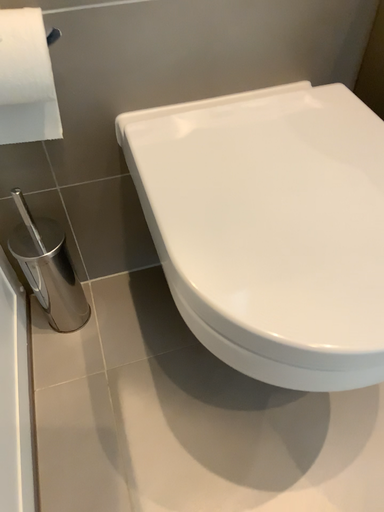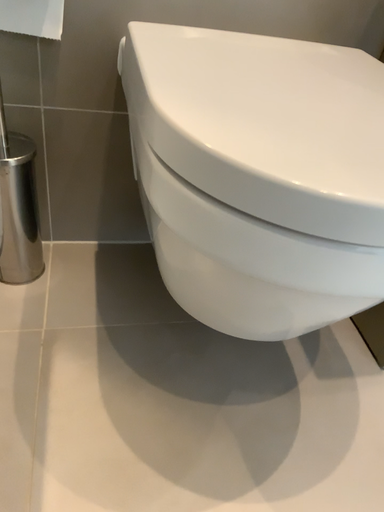
Question: Which way did the camera rotate in the video?

Choices:
 (A) rotated downward
 (B) rotated upward

Answer: (B)